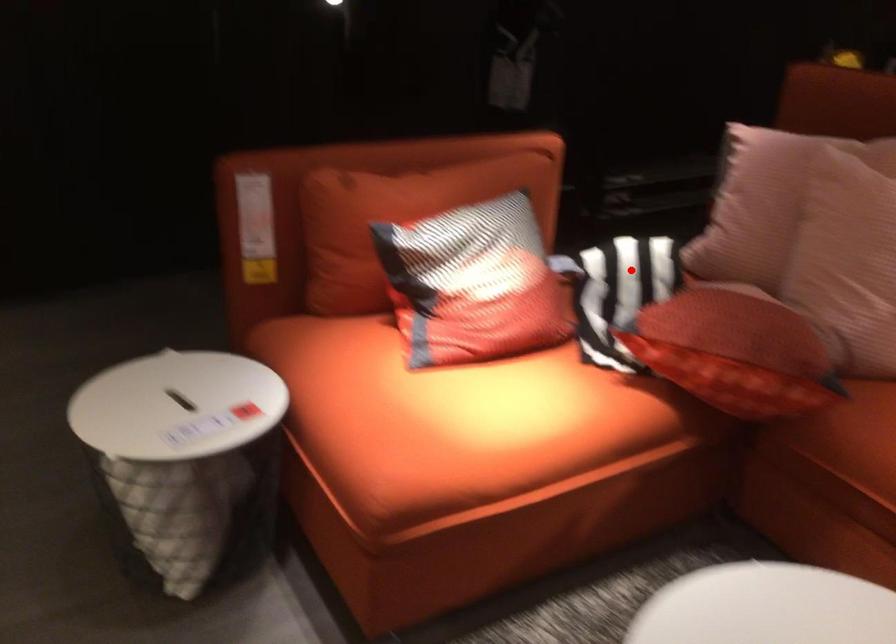
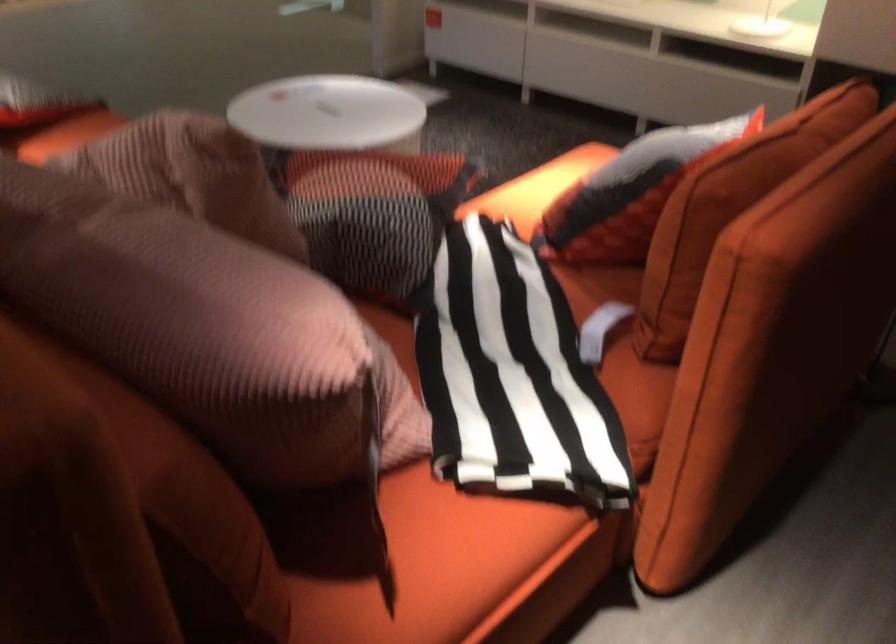
Find the pixel in the second image that matches the highlighted location in the first image.

(512, 375)